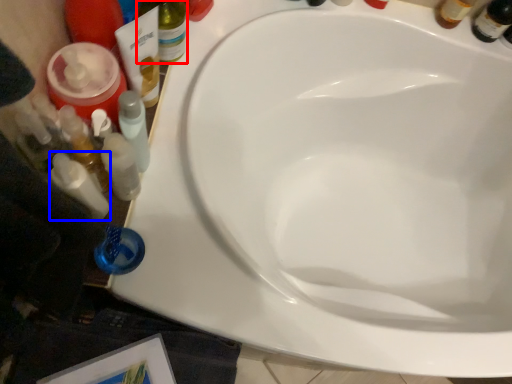
Question: Which of the following is the farthest to the observer, bottle (highlighted by a red box) or toiletry (highlighted by a blue box)?

Choices:
 (A) bottle
 (B) toiletry

Answer: (A)